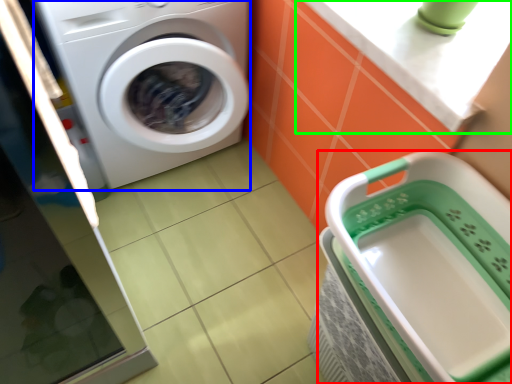
Question: Estimate the real-world distances between objects in this image. Which object is closer to dish washer (highlighted by a red box), washing machine (highlighted by a blue box) or counter top (highlighted by a green box)?

Choices:
 (A) washing machine
 (B) counter top

Answer: (B)